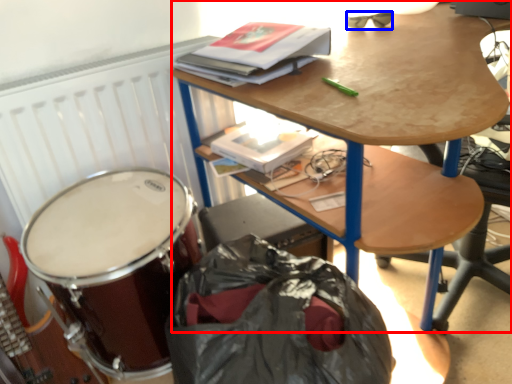
Question: Which of the following is the farthest to the observer, desk (highlighted by a red box) or glasses (highlighted by a blue box)?

Choices:
 (A) desk
 (B) glasses

Answer: (B)